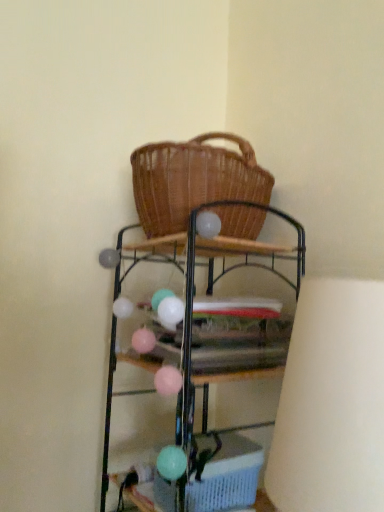
This screenshot has width=384, height=512. What are the coordinates of `light blue plastic basket at lower center` in the screenshot? It's located at (228, 477).

The height and width of the screenshot is (512, 384). What do you see at coordinates (228, 477) in the screenshot? I see `light blue plastic basket at lower center` at bounding box center [228, 477].

Identify the location of metallic wire shelf at center. (205, 322).

In order to face metallic wire shelf at center, should I rotate leftwards or rightwards?

Turn right approximately 1.898 degrees to face it.

Image resolution: width=384 pixels, height=512 pixels. Describe the element at coordinates (205, 322) in the screenshot. I see `metallic wire shelf at center` at that location.

The image size is (384, 512). Find the location of `light blue plastic basket at lower center`. light blue plastic basket at lower center is located at coordinates (228, 477).

Based on their positions, is light blue plastic basket at lower center located to the left or right of metallic wire shelf at center?

light blue plastic basket at lower center is to the left of metallic wire shelf at center.

Is light blue plastic basket at lower center in front of or behind metallic wire shelf at center in the image?

light blue plastic basket at lower center is behind metallic wire shelf at center.

Considering the points (243, 499) and (168, 360), which point is in front, point (243, 499) or point (168, 360)?

Positioned in front is point (243, 499).

From the image's perspective, between light blue plastic basket at lower center and metallic wire shelf at center, who is located below?

light blue plastic basket at lower center is shown below in the image.

From a real-world perspective, is light blue plastic basket at lower center beneath metallic wire shelf at center?

Correct, in the physical world, light blue plastic basket at lower center is lower than metallic wire shelf at center.

Which object is thinner, light blue plastic basket at lower center or metallic wire shelf at center?

With smaller width is light blue plastic basket at lower center.

Considering the sizes of objects light blue plastic basket at lower center and metallic wire shelf at center in the image provided, who is taller, light blue plastic basket at lower center or metallic wire shelf at center?

metallic wire shelf at center is taller.

Is light blue plastic basket at lower center bigger than metallic wire shelf at center?

No, light blue plastic basket at lower center is not bigger than metallic wire shelf at center.

Is light blue plastic basket at lower center positioned beyond the bounds of metallic wire shelf at center?

No.

Is light blue plastic basket at lower center far from metallic wire shelf at center?

No, light blue plastic basket at lower center is in close proximity to metallic wire shelf at center.

Is metallic wire shelf at center at the back of light blue plastic basket at lower center?

Yes, light blue plastic basket at lower center is facing away from metallic wire shelf at center.

How far apart are light blue plastic basket at lower center and metallic wire shelf at center?

The distance of light blue plastic basket at lower center from metallic wire shelf at center is 9.35 inches.

You are a GUI agent. You are given a task and a screenshot of the screen. Output one action in this format:
    pyautogui.click(x=<x>, y=<y>)
    Task: Click on the shelf above the light blue plastic basket at lower center (from the image's perspective)
    This screenshot has height=512, width=384.
    Given the screenshot: What is the action you would take?
    pyautogui.click(x=205, y=322)

Which object is positioned more to the left, metallic wire shelf at center or light blue plastic basket at lower center?

Positioned to the left is light blue plastic basket at lower center.

Which is behind, metallic wire shelf at center or light blue plastic basket at lower center?

light blue plastic basket at lower center.

Considering the points (190, 430) and (215, 460), which point is behind, point (190, 430) or point (215, 460)?

Positioned behind is point (215, 460).

From the image's perspective, between metallic wire shelf at center and light blue plastic basket at lower center, who is located below?

light blue plastic basket at lower center is shown below in the image.

From a real-world perspective, relative to light blue plastic basket at lower center, is metallic wire shelf at center vertically above or below?

From a real-world perspective, metallic wire shelf at center is physically above light blue plastic basket at lower center.

Which of these two, metallic wire shelf at center or light blue plastic basket at lower center, is thinner?

light blue plastic basket at lower center is thinner.

Which of these two, metallic wire shelf at center or light blue plastic basket at lower center, stands taller?

metallic wire shelf at center is taller.

Based on their sizes in the image, would you say metallic wire shelf at center is bigger or smaller than light blue plastic basket at lower center?

Considering their sizes, metallic wire shelf at center takes up more space than light blue plastic basket at lower center.

Would you say metallic wire shelf at center is inside or outside light blue plastic basket at lower center?

The correct answer is: outside.

Is metallic wire shelf at center touching light blue plastic basket at lower center?

No, metallic wire shelf at center is not beside light blue plastic basket at lower center.

Is metallic wire shelf at center facing away from light blue plastic basket at lower center?

That's right, metallic wire shelf at center is facing away from light blue plastic basket at lower center.

Can you tell me how much metallic wire shelf at center and light blue plastic basket at lower center differ in facing direction?

There is a 4-degree angle between the facing directions of metallic wire shelf at center and light blue plastic basket at lower center.

I want to click on shelf positioned vertically above the light blue plastic basket at lower center (from a real-world perspective), so click(205, 322).

Image resolution: width=384 pixels, height=512 pixels. I want to click on basket behind the metallic wire shelf at center, so click(228, 477).

Locate an element on the screen. shelf that is on the right side of light blue plastic basket at lower center is located at coordinates (205, 322).